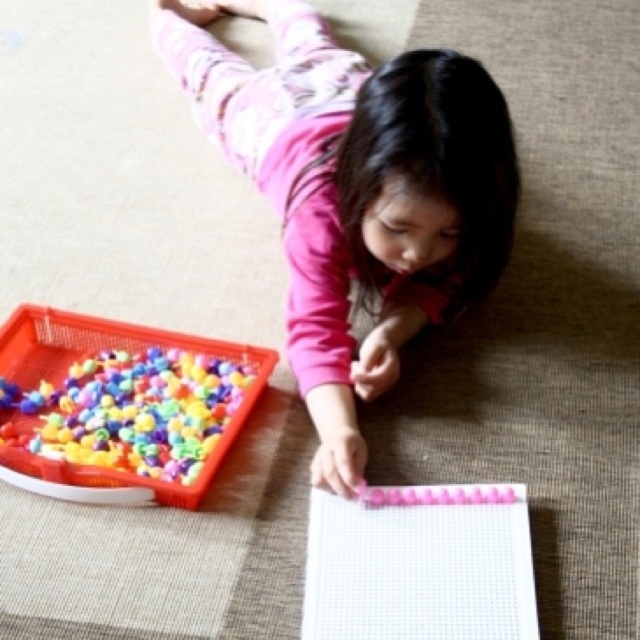
The height and width of the screenshot is (640, 640). Describe the element at coordinates (355, 192) in the screenshot. I see `pink matte fabric at center` at that location.

The image size is (640, 640). In order to click on pink matte fabric at center in this screenshot , I will do coord(355,192).

Between point (371, 150) and point (109, 422), which one is positioned in front?

Point (371, 150) is in front.

Identify the location of pink matte fabric at center. (355, 192).